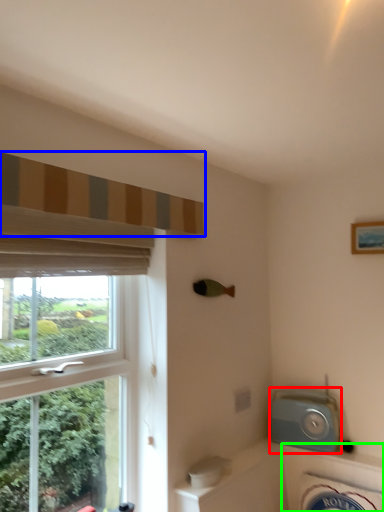
Question: Considering the real-world distances, which object is closest to appliance (highlighted by a red box)? curtain (highlighted by a blue box) or bath (highlighted by a green box).

Choices:
 (A) curtain
 (B) bath

Answer: (B)